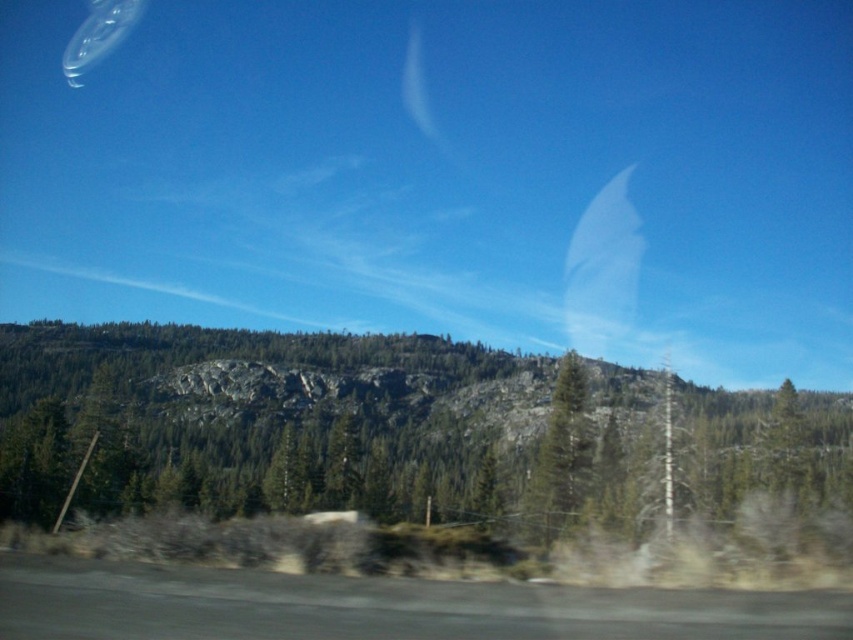
You are driving along a mountain road and notice two trees ahead in the center of your view. The trees are both labeled as green textured tree at center and green matte tree at center. Which tree would appear closer to you based on their size?

The green textured tree at center appears closer because it is bigger than the green matte tree at center, and larger objects in the distance typically appear smaller due to perspective, so the bigger size suggests it is nearer.

You are a passenger in a moving vehicle and notice a green textured tree at center through the window. Can you determine if this tree is closer to the vehicle compared to the rocky hills in the background?

The green textured tree at center is located at point (310, 422), which places it in the middle ground rather than the background. Since the rocky hills are in the background, the tree is closer to the vehicle than the rocky hills.